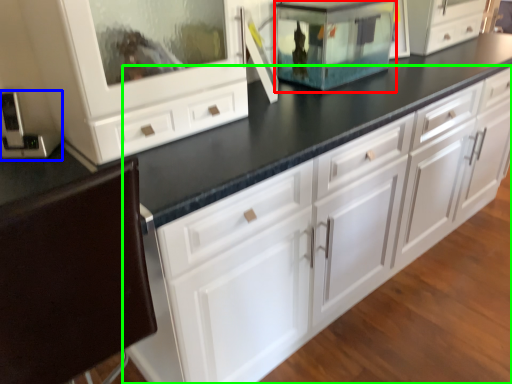
Question: Which is farther away from appliance (highlighted by a red box)? appliance (highlighted by a blue box) or chest of drawers (highlighted by a green box)?

Choices:
 (A) appliance
 (B) chest of drawers

Answer: (A)